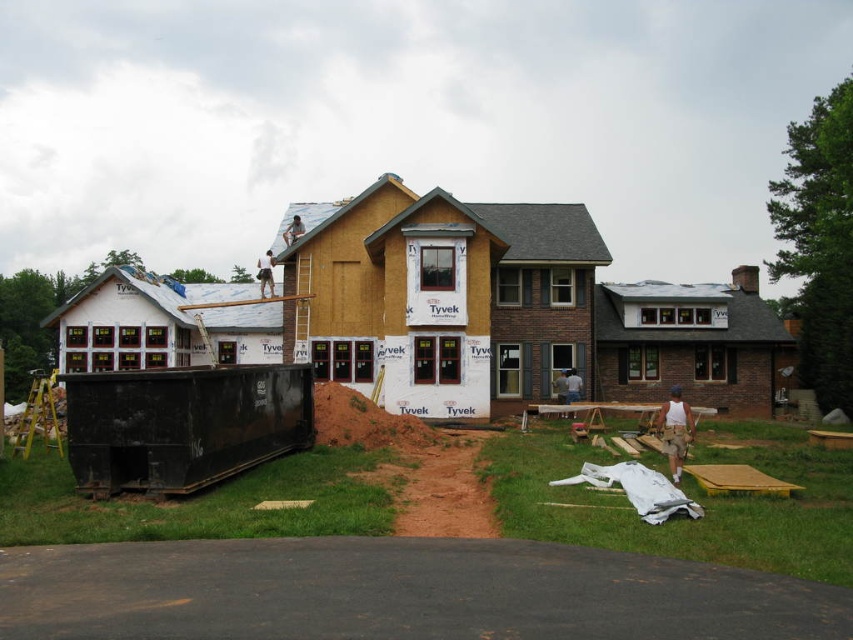
Who is more distant from viewer, (683, 435) or (569, 384)?

The point (569, 384) is more distant.

Can you confirm if tan fabric construction worker at lower right is wider than tan fabric shirt at lower right?

Correct, the width of tan fabric construction worker at lower right exceeds that of tan fabric shirt at lower right.

The height and width of the screenshot is (640, 853). Describe the element at coordinates (675, 432) in the screenshot. I see `tan fabric construction worker at lower right` at that location.

Where is `tan fabric construction worker at lower right`? tan fabric construction worker at lower right is located at coordinates (675, 432).

Is tan fabric shirt at lower right to the left of light brown wooden ladder at upper center from the viewer's perspective?

In fact, tan fabric shirt at lower right is to the right of light brown wooden ladder at upper center.

Is point (576, 392) positioned before point (294, 227)?

Yes.

Find the location of a particular element. This screenshot has height=640, width=853. tan fabric shirt at lower right is located at coordinates (573, 385).

Identify the location of tan fabric construction worker at upper center. This screenshot has height=640, width=853. (265, 273).

Does tan fabric construction worker at upper center appear under tan fabric shirt at lower right?

Incorrect, tan fabric construction worker at upper center is not positioned below tan fabric shirt at lower right.

Is point (257, 273) behind point (581, 385)?

That is True.

The width and height of the screenshot is (853, 640). I want to click on tan fabric construction worker at upper center, so click(x=265, y=273).